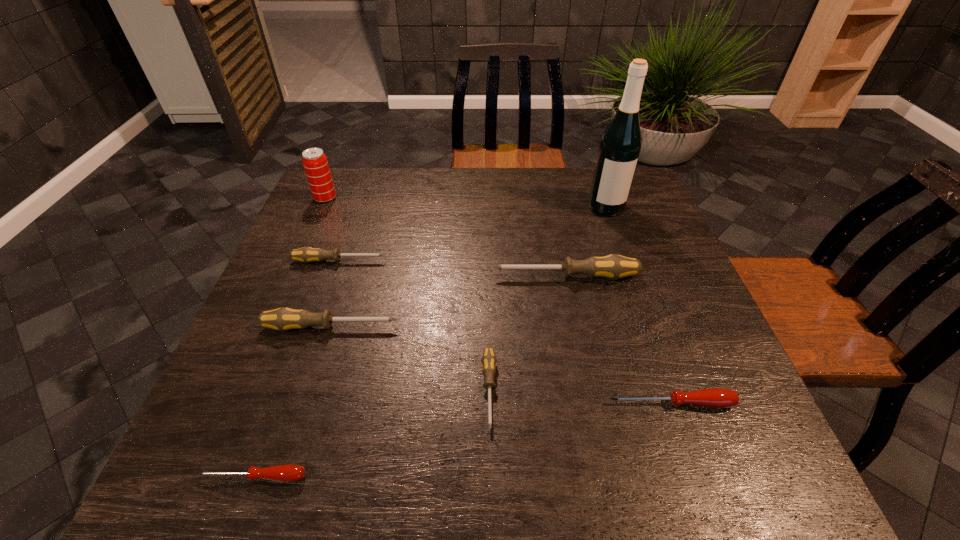
Identify the location of free region located 0.380m at the tip of the farthest screwdriver. (534, 261).

Locate an element on the screen. free space located 0.320m on the back of the farther red screwdriver is located at coordinates (628, 280).

The image size is (960, 540). In order to click on vacant space situated 0.320m on the right of the nearest object in this screenshot , I will do `click(497, 477)`.

Locate an element on the screen. The width and height of the screenshot is (960, 540). wine bottle present at the far edge is located at coordinates (620, 146).

Identify the location of soda can that is at the far edge. (315, 163).

Where is `object that is at the near edge`? Image resolution: width=960 pixels, height=540 pixels. object that is at the near edge is located at coordinates (288, 472).

The image size is (960, 540). In order to click on soda can positioned at the left edge in this screenshot , I will do `click(315, 163)`.

This screenshot has height=540, width=960. I want to click on wine bottle positioned at the right edge, so click(620, 146).

Locate an element on the screen. This screenshot has width=960, height=540. object that is at the far left corner is located at coordinates (315, 163).

This screenshot has width=960, height=540. Identify the location of object situated at the near left corner. (288, 472).